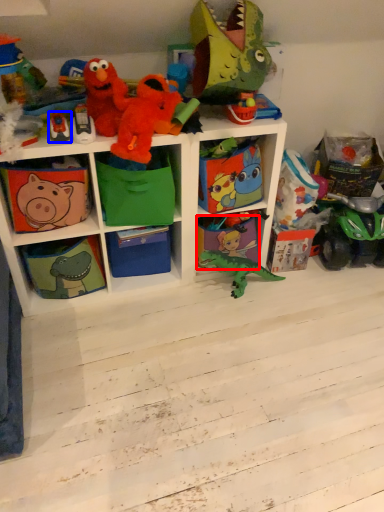
Question: Which object is further to the camera taking this photo, shelf (highlighted by a red box) or toy (highlighted by a blue box)?

Choices:
 (A) shelf
 (B) toy

Answer: (A)